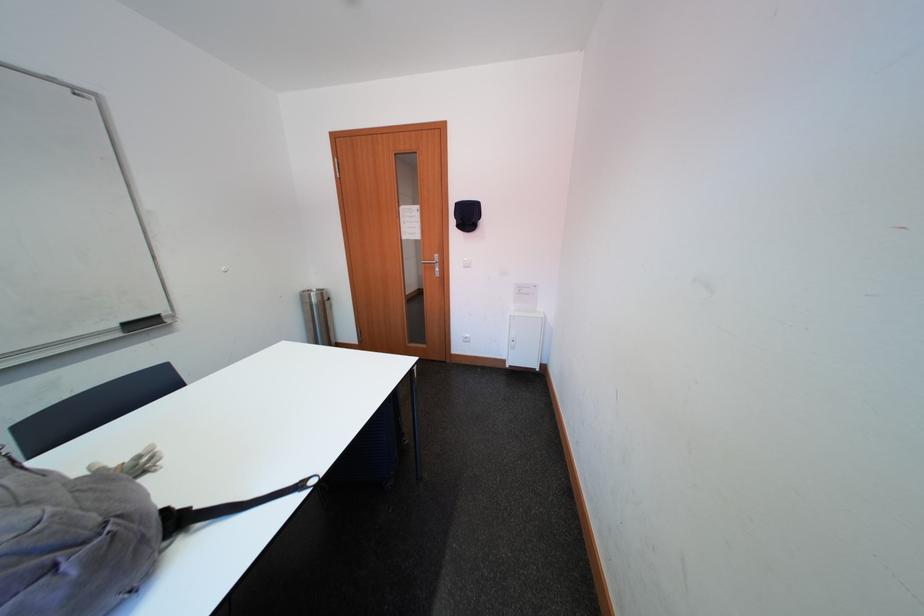
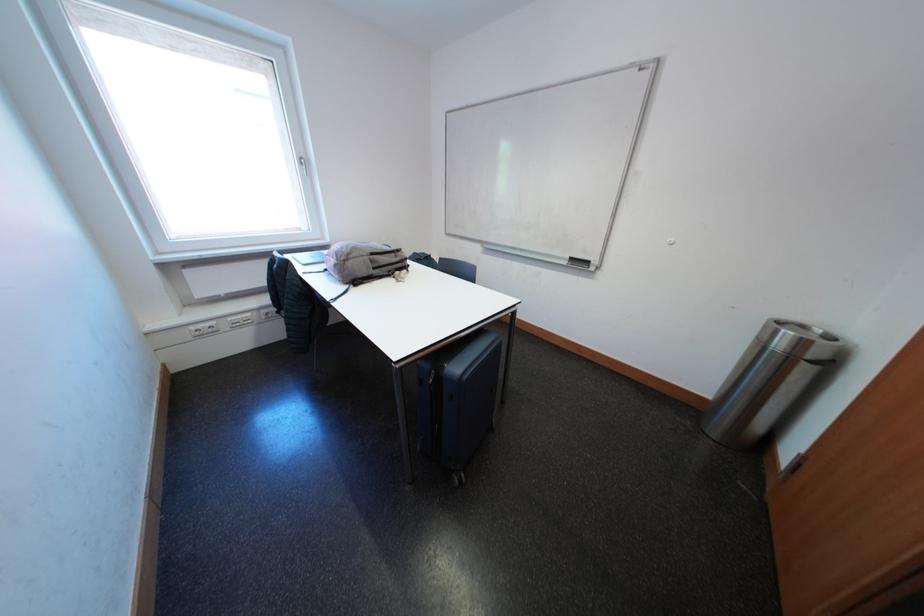
Where in the second image is the point corresponding to (128,338) from the first image?

(575, 267)